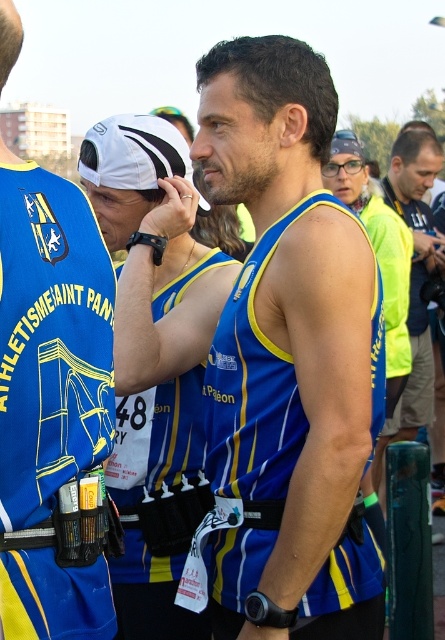
Question: Is blue/yellow athletic vest at left below blue/yellow athletic vest at center?

Choices:
 (A) yes
 (B) no

Answer: (B)

Question: Among these points, which one is nearest to the camera?

Choices:
 (A) (407, 426)
 (B) (49, 397)
 (C) (117, 568)
 (D) (298, 458)

Answer: (B)

Question: Which point is farther from the camera taking this photo?

Choices:
 (A) (76, 248)
 (B) (356, 595)

Answer: (B)

Question: Can you confirm if blue/yellow athletic vest at center is positioned to the left of yellow fabric vest at right?

Choices:
 (A) yes
 (B) no

Answer: (A)

Question: Is blue/yellow athletic vest at left thinner than blue/yellow athletic vest at center?

Choices:
 (A) yes
 (B) no

Answer: (A)

Question: Which point is closer to the camera?

Choices:
 (A) blue/yellow athletic vest at left
 (B) blue/yellow athletic vest at center
 (C) yellow fabric vest at right

Answer: (A)